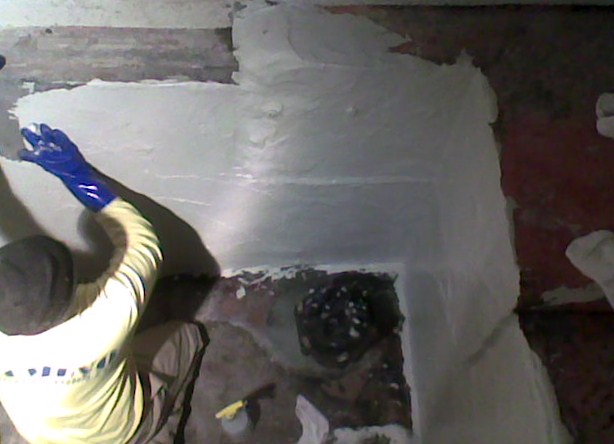
At what (x,y) coordinates should I click in order to perform the action: click on spray bottle. Please return your answer as a coordinate pair (x, y). This screenshot has width=614, height=444. Looking at the image, I should click on (239, 421).